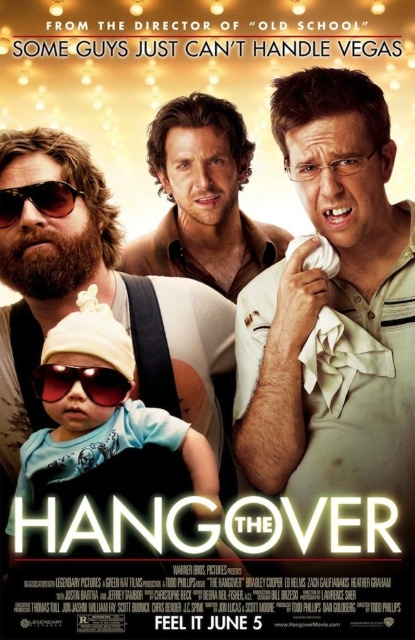
Is the position of white striped polo shirt at center more distant than that of sunglassesmatte/black at left?

Yes.

Does point (285, 106) come farther from viewer compared to point (36, 204)?

Yes, point (285, 106) is behind point (36, 204).

Who is more distant from viewer, (344, 433) or (4, 195)?

Result: Point (344, 433)

In order to click on white striped polo shirt at center in this screenshot , I will do `click(334, 308)`.

Which is behind, point (227, 250) or point (105, 376)?

The point (227, 250) is more distant.

Which is in front, point (180, 156) or point (85, 392)?

Point (85, 392) is more forward.

The image size is (415, 640). Find the location of `matte brown shirt at center`. matte brown shirt at center is located at coordinates (202, 198).

Does white striped polo shirt at center appear on the left side of translucent plastic goggles at center?

Incorrect, white striped polo shirt at center is not on the left side of translucent plastic goggles at center.

Does white striped polo shirt at center have a lesser height compared to translucent plastic goggles at center?

In fact, white striped polo shirt at center may be taller than translucent plastic goggles at center.

At what (x,y) coordinates should I click in order to perform the action: click on white striped polo shirt at center. Please return your answer as a coordinate pair (x, y). Looking at the image, I should click on (334, 308).

Locate an element on the screen. The width and height of the screenshot is (415, 640). white striped polo shirt at center is located at coordinates [x=334, y=308].